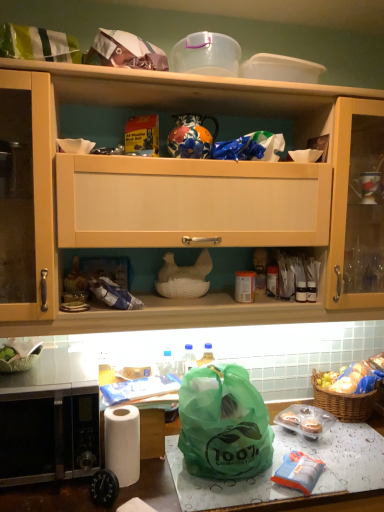
The width and height of the screenshot is (384, 512). Find the location of `vacant space to the right of white matte paper towel at lower left`. vacant space to the right of white matte paper towel at lower left is located at coordinates (166, 492).